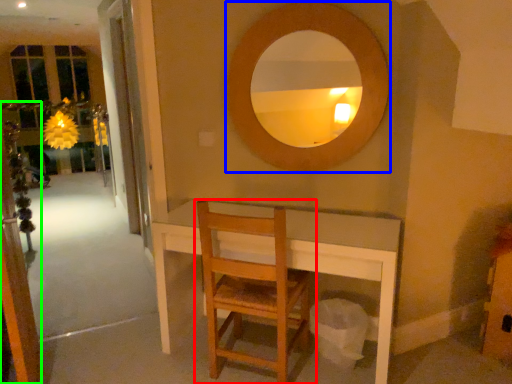
Question: Estimate the real-world distances between objects in this image. Which object is farther from chair (highlighted by a red box), mirror (highlighted by a blue box) or screen door (highlighted by a green box)?

Choices:
 (A) mirror
 (B) screen door

Answer: (B)